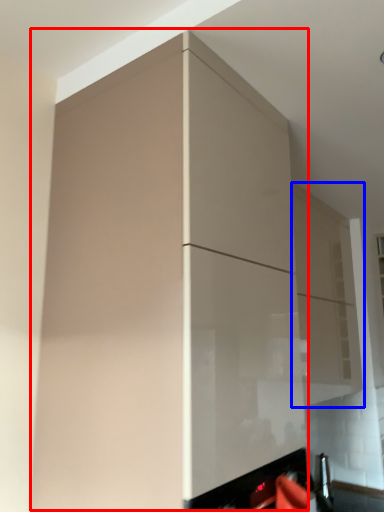
Question: Which object appears farthest to the camera in this image, cabinetry (highlighted by a red box) or cabinetry (highlighted by a blue box)?

Choices:
 (A) cabinetry
 (B) cabinetry

Answer: (B)